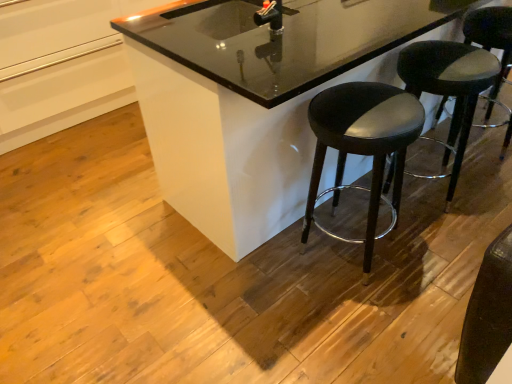
The height and width of the screenshot is (384, 512). Find the location of `vacant area that is in front of black leather stool at right, placed as the first stool when sorted from right to left`. vacant area that is in front of black leather stool at right, placed as the first stool when sorted from right to left is located at coordinates (487, 183).